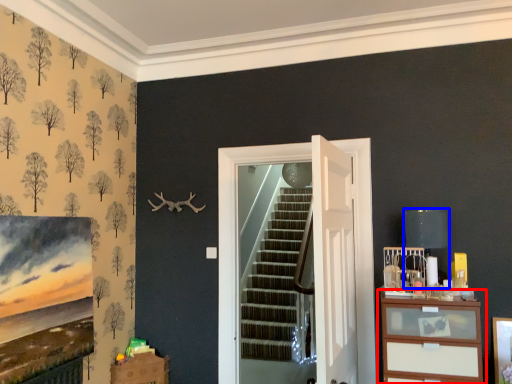
Question: Among these objects, which one is farthest to the camera, chest of drawers (highlighted by a red box) or lamp (highlighted by a blue box)?

Choices:
 (A) chest of drawers
 (B) lamp

Answer: (B)